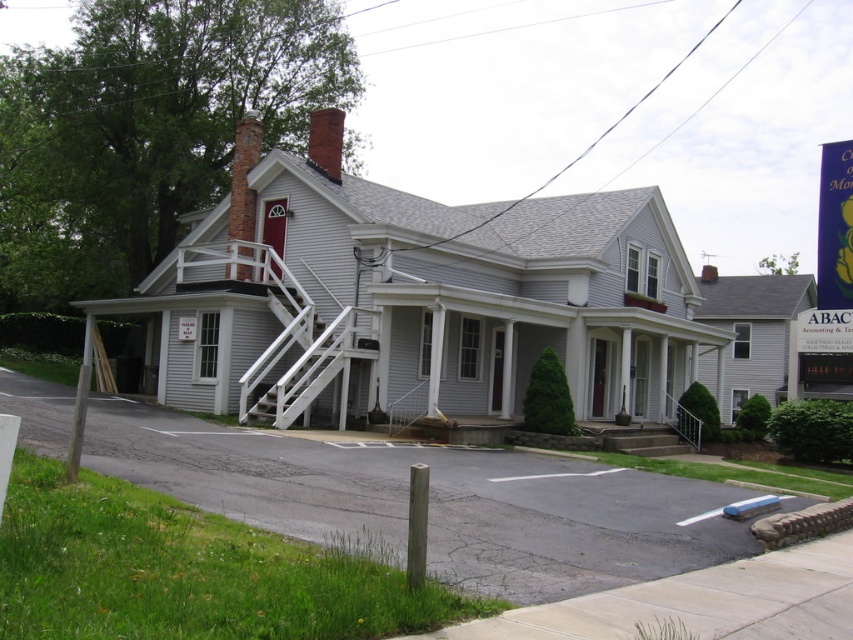
Does brick chimney at upper left have a lesser height compared to brown wooden post at lower center?

Correct, brick chimney at upper left is not as tall as brown wooden post at lower center.

The image size is (853, 640). Describe the element at coordinates (242, 177) in the screenshot. I see `brick chimney at upper left` at that location.

Find the location of a particular element. brick chimney at upper left is located at coordinates (242, 177).

Can you confirm if white painted wood porch at center is positioned to the left of white wooden staircase at center?

No, white painted wood porch at center is not to the left of white wooden staircase at center.

Based on the photo, can you confirm if white painted wood porch at center is wider than white wooden staircase at center?

Correct, the width of white painted wood porch at center exceeds that of white wooden staircase at center.

Find the location of a particular element. The image size is (853, 640). white painted wood porch at center is located at coordinates (289, 337).

Who is positioned more to the right, white wooden staircase at center or brick chimney at upper left?

white wooden staircase at center

Does white wooden staircase at center appear over brick chimney at upper left?

Incorrect, white wooden staircase at center is not positioned above brick chimney at upper left.

Is point (334, 340) positioned before point (247, 157)?

Yes, point (334, 340) is closer to viewer.

Image resolution: width=853 pixels, height=640 pixels. I want to click on white wooden staircase at center, so click(x=305, y=374).